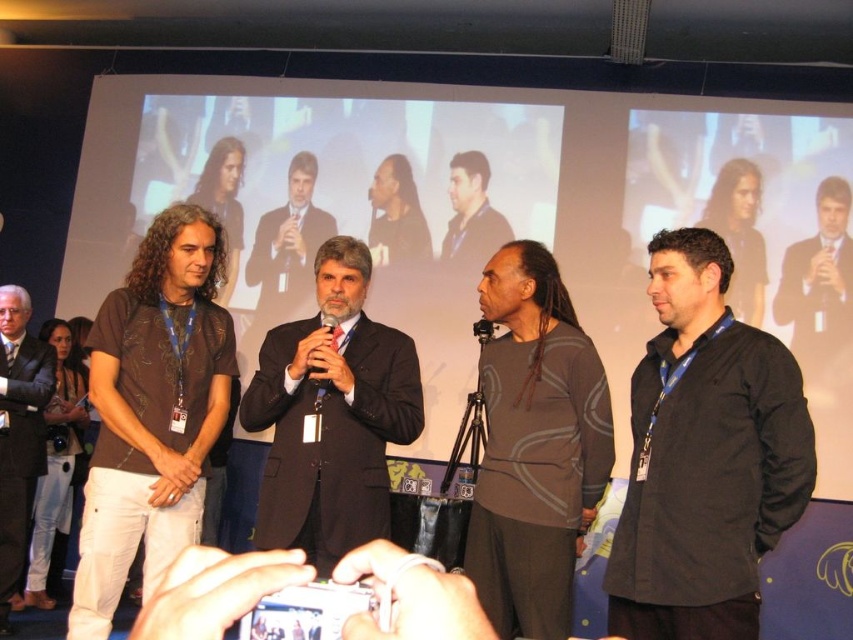
Can you confirm if brown matte shirt at left is positioned to the right of black plastic microphone at center?

No, brown matte shirt at left is not to the right of black plastic microphone at center.

Between brown matte shirt at left and black plastic microphone at center, which one is positioned higher?

Positioned higher is black plastic microphone at center.

What are the coordinates of `brown matte shirt at left` in the screenshot? It's located at (152, 410).

At what (x,y) coordinates should I click in order to perform the action: click on brown matte shirt at left. Please return your answer as a coordinate pair (x, y). The height and width of the screenshot is (640, 853). Looking at the image, I should click on (152, 410).

Is black matte jacket at right above dark brown suit at center?

Yes.

Who is taller, black matte jacket at right or dark brown suit at center?

dark brown suit at center is taller.

At what (x,y) coordinates should I click in order to perform the action: click on black matte jacket at right. Please return your answer as a coordinate pair (x, y). The width and height of the screenshot is (853, 640). Looking at the image, I should click on pos(705,456).

Is brown matte shirt at left behind dark brown textured shirt at center?

No, brown matte shirt at left is closer to the viewer.

Is point (94, 342) positioned before point (457, 211)?

Yes, point (94, 342) is in front of point (457, 211).

I want to click on brown matte shirt at left, so click(152, 410).